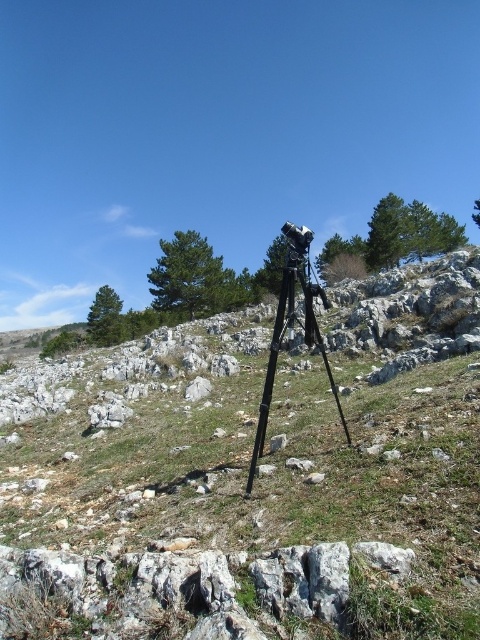
Question: Which of the following is the closest to the observer?

Choices:
 (A) black matte tripod at center
 (B) green grassy at center

Answer: (B)

Question: Does green grassy at center have a larger size compared to black matte tripod at center?

Choices:
 (A) no
 (B) yes

Answer: (A)

Question: Is green grassy at center to the right of black matte tripod at center from the viewer's perspective?

Choices:
 (A) yes
 (B) no

Answer: (B)

Question: Is green grassy at center positioned in front of black matte tripod at center?

Choices:
 (A) no
 (B) yes

Answer: (B)

Question: Among these objects, which one is nearest to the camera?

Choices:
 (A) green grassy at center
 (B) black matte tripod at center

Answer: (A)